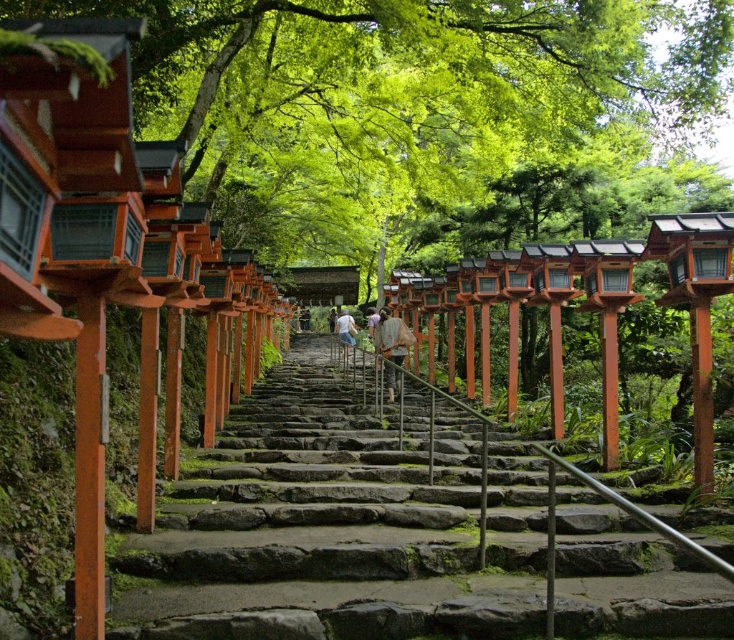
You are a tourist standing at the bottom of the stone staircase. You want to take a photo of the light brown wooden post at center without the smooth stone stairs at center blocking the view. Is this possible?

The smooth stone stairs at center is in front of the light brown wooden post at center, so taking a photo without the stairs blocking the view would require moving to a position where the stairs are not between you and the post. However, since the stairs are in front of the post, you might need to adjust your angle or move around to the side to capture the post without obstruction.

You are standing at the base of the stone staircase surrounded by torii gates and greenery. You want to take a photo of the point at coordinate point (520,76). If your camera has a maximum zoom range of 10 meters, will you be able to capture the point clearly without moving closer?

The point at coordinate point (520,76) is 15.11 meters away from the camera. Since the camera can only zoom up to 10 meters, you will not be able to capture the point clearly without moving closer.

You are standing at the base of the stone staircase in the Japanese garden and want to place your light brown leather backpack at center so that it is exactly 20 feet away from the green leafy tree at upper center. Based on the current placement, is the backpack too close or too far from the tree?

The distance between the green leafy tree at upper center and the light brown leather backpack at center is currently 21.08 feet. Since 21.08 feet is greater than 20 feet, the backpack is too far from the tree and needs to be moved closer by approximately 1.08 feet to meet the desired distance.